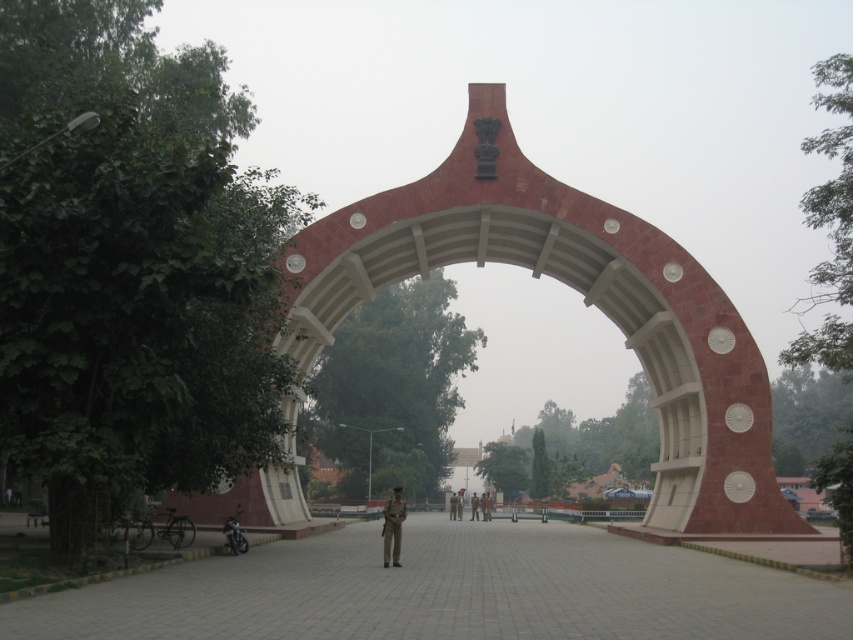
Can you confirm if uniformed officer at center is wider than red uniformed person at center?

Yes, uniformed officer at center is wider than red uniformed person at center.

Can you confirm if uniformed officer at center is positioned to the left of red uniformed person at center?

Yes, uniformed officer at center is to the left of red uniformed person at center.

Between point (386, 518) and point (473, 497), which one is positioned in front?

Point (386, 518)

Where is `uniformed officer at center`? uniformed officer at center is located at coordinates (392, 528).

Can you confirm if red uniformed person at center is thinner than brown uniform at center?

Yes.

Identify the location of red uniformed person at center. The height and width of the screenshot is (640, 853). (474, 506).

Locate an element on the screen. Image resolution: width=853 pixels, height=640 pixels. red uniformed person at center is located at coordinates (474, 506).

Can you confirm if uniformed officer at center is smaller than brown uniform at center?

No, uniformed officer at center is not smaller than brown uniform at center.

Where is `uniformed officer at center`? The image size is (853, 640). uniformed officer at center is located at coordinates (392, 528).